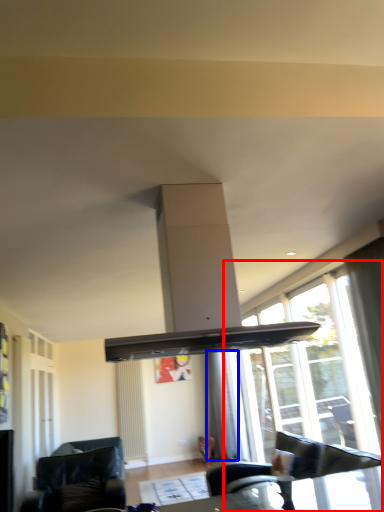
Question: Which object appears closest to the camera in this image, window (highlighted by a red box) or curtain (highlighted by a blue box)?

Choices:
 (A) window
 (B) curtain

Answer: (A)